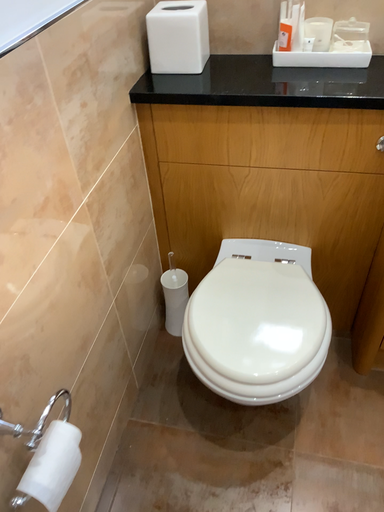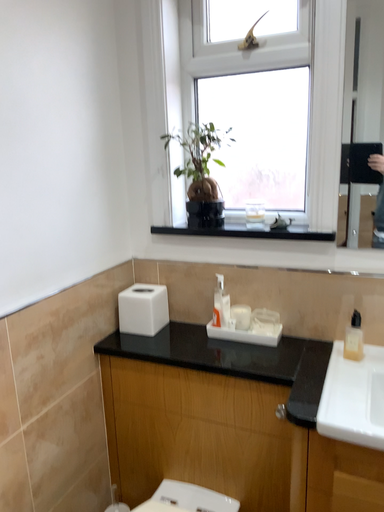
Question: Which way did the camera rotate in the video?

Choices:
 (A) rotated upward
 (B) rotated downward

Answer: (A)